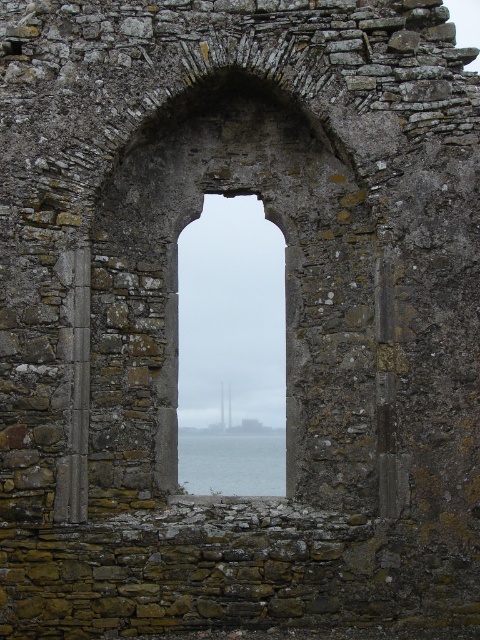
Question: Is transparent glass window at center wider than transparent glass water at center?

Choices:
 (A) yes
 (B) no

Answer: (B)

Question: Which object appears closest to the camera in this image?

Choices:
 (A) transparent glass water at center
 (B) transparent glass window at center

Answer: (A)

Question: Does transparent glass window at center appear on the left side of transparent glass water at center?

Choices:
 (A) yes
 (B) no

Answer: (B)

Question: Which point is farther from the camera taking this photo?

Choices:
 (A) (214, 221)
 (B) (254, 493)

Answer: (B)

Question: Which point is farther to the camera?

Choices:
 (A) (226, 378)
 (B) (196, 481)

Answer: (B)

Question: Does transparent glass window at center appear over transparent glass water at center?

Choices:
 (A) yes
 (B) no

Answer: (A)